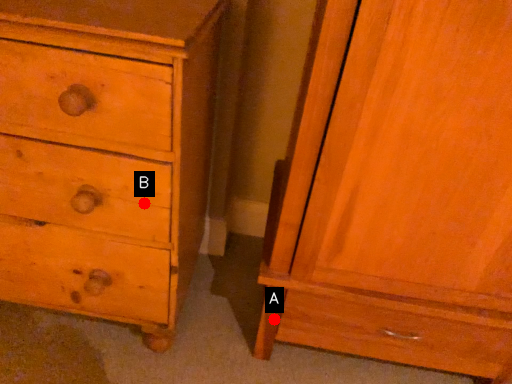
Question: Two points are circled on the image, labeled by A and B beside each circle. Which point appears farthest from the camera in this image?

Choices:
 (A) A is further
 (B) B is further

Answer: (A)